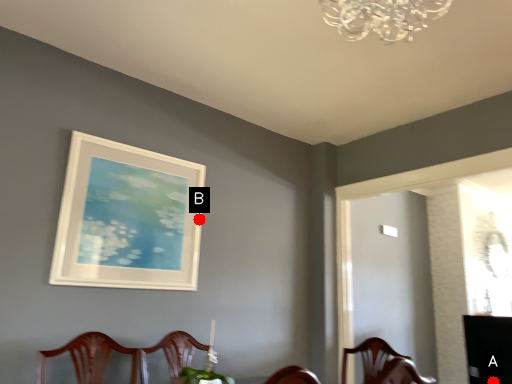
Question: Two points are circled on the image, labeled by A and B beside each circle. Which point is closer to the camera?

Choices:
 (A) A is closer
 (B) B is closer

Answer: (B)